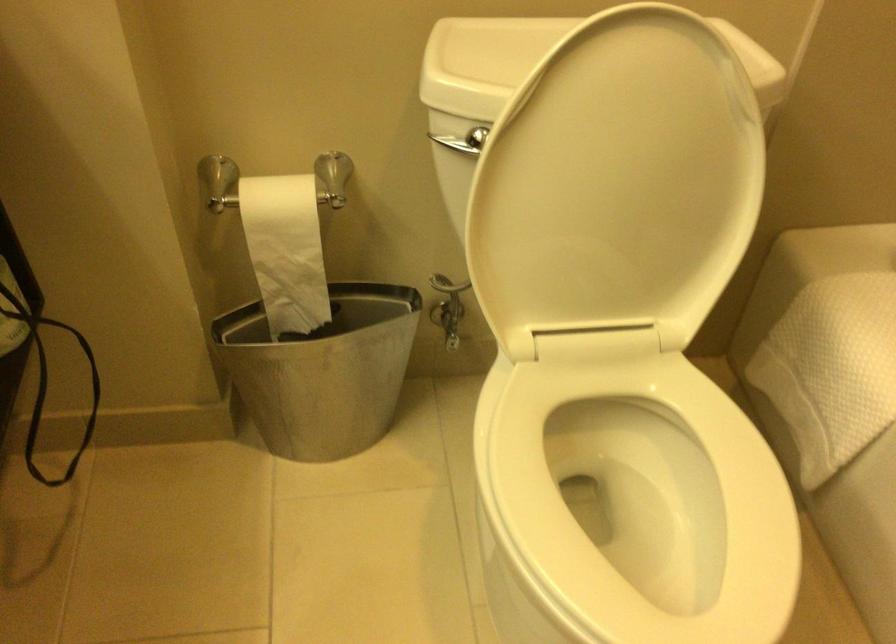
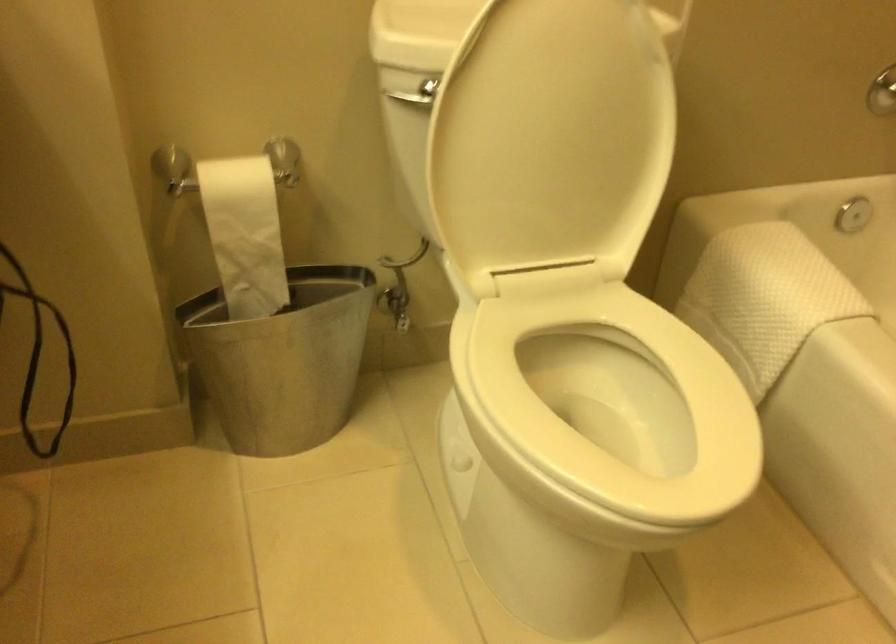
In a continuous first-person perspective shot, in which direction is the camera moving?

The movement direction of the cameraman is left, backward.